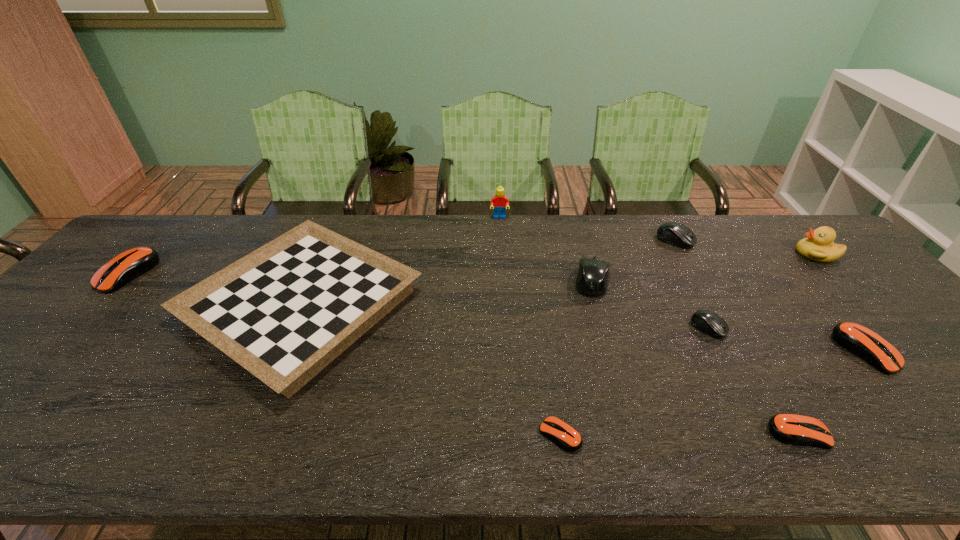
Identify the location of the farthest object. The width and height of the screenshot is (960, 540). (500, 202).

Locate an element on the screen. This screenshot has width=960, height=540. red Lego is located at coordinates (500, 202).

Find the location of a particular element. the second tallest object is located at coordinates (818, 246).

This screenshot has height=540, width=960. Identify the location of duckling. (818, 246).

At what (x,y) coordinates should I click in order to perform the action: click on the second farthest black mouse. Please return your answer as a coordinate pair (x, y). Image resolution: width=960 pixels, height=540 pixels. Looking at the image, I should click on (592, 279).

Find the location of a particular element. Image resolution: width=960 pixels, height=540 pixels. the tallest computer mouse is located at coordinates (592, 279).

You are a GUI agent. You are given a task and a screenshot of the screen. Output one action in this format:
    pyautogui.click(x=<x>, y=<y>)
    Task: Click on the checkerboard
    
    Given the screenshot: What is the action you would take?
    pyautogui.click(x=285, y=311)

Where is `the farthest computer mouse`? the farthest computer mouse is located at coordinates (673, 233).

Locate an element on the screen. Image resolution: width=960 pixels, height=540 pixels. the farthest black mouse is located at coordinates (673, 233).

I want to click on the biggest orange computer mouse, so click(125, 267).